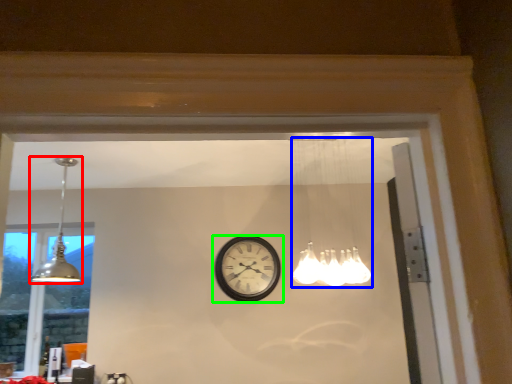
Question: Based on their relative distances, which object is nearer to lamp (highlighted by a red box)? Choose from lamp (highlighted by a blue box) and wall clock (highlighted by a green box).

Choices:
 (A) lamp
 (B) wall clock

Answer: (B)